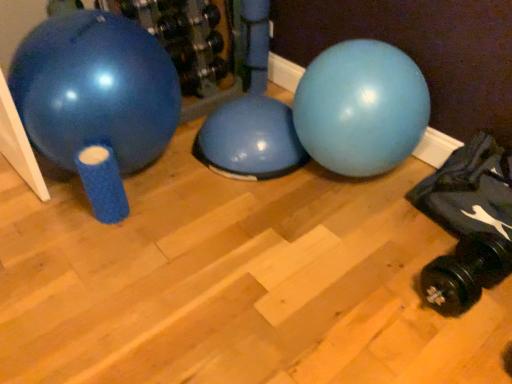
What is the approximate width of matte blue exercise ball at left?

matte blue exercise ball at left is 26.15 inches wide.

This screenshot has height=384, width=512. What do you see at coordinates (95, 89) in the screenshot?
I see `matte blue exercise ball at left` at bounding box center [95, 89].

The height and width of the screenshot is (384, 512). I want to click on matte blue exercise ball at left, so click(x=95, y=89).

Locate an element on the screen. Image resolution: width=512 pixels, height=384 pixels. black rubber dumbbell at lower right is located at coordinates (466, 272).

What do you see at coordinates (466, 272) in the screenshot? I see `black rubber dumbbell at lower right` at bounding box center [466, 272].

In order to face black rubber dumbbell at lower right, should I rotate leftwards or rightwards?

You should look right and rotate roughly 26.144 degrees.

Locate an element on the screen. This screenshot has height=384, width=512. matte blue exercise ball at left is located at coordinates (95, 89).

In the image, is matte blue exercise ball at left on the left side or the right side of black rubber dumbbell at lower right?

From the image, it's evident that matte blue exercise ball at left is to the left of black rubber dumbbell at lower right.

From the picture: Is the position of matte blue exercise ball at left more distant than that of black rubber dumbbell at lower right?

Yes, matte blue exercise ball at left is behind black rubber dumbbell at lower right.

Considering the positions of point (91, 118) and point (426, 276), is point (91, 118) closer or farther from the camera than point (426, 276)?

Point (91, 118).

From the image's perspective, is matte blue exercise ball at left beneath black rubber dumbbell at lower right?

No, from the image's perspective, matte blue exercise ball at left is not beneath black rubber dumbbell at lower right.

From a real-world perspective, does matte blue exercise ball at left sit lower than black rubber dumbbell at lower right?

No, from a real-world perspective, matte blue exercise ball at left is not below black rubber dumbbell at lower right.

Considering the sizes of objects matte blue exercise ball at left and black rubber dumbbell at lower right in the image provided, who is thinner, matte blue exercise ball at left or black rubber dumbbell at lower right?

Thinner between the two is black rubber dumbbell at lower right.

Who is taller, matte blue exercise ball at left or black rubber dumbbell at lower right?

matte blue exercise ball at left is taller.

Considering the sizes of objects matte blue exercise ball at left and black rubber dumbbell at lower right in the image provided, who is bigger, matte blue exercise ball at left or black rubber dumbbell at lower right?

matte blue exercise ball at left is bigger.

Is matte blue exercise ball at left outside of black rubber dumbbell at lower right?

Yes, matte blue exercise ball at left is not within black rubber dumbbell at lower right.

Is matte blue exercise ball at left placed right next to black rubber dumbbell at lower right?

No, matte blue exercise ball at left is not next to black rubber dumbbell at lower right.

Is matte blue exercise ball at left looking in the opposite direction of black rubber dumbbell at lower right?

No, matte blue exercise ball at left is not facing away from black rubber dumbbell at lower right.

Can you tell me how much matte blue exercise ball at left and black rubber dumbbell at lower right differ in facing direction?

85.8 degrees separate the facing orientations of matte blue exercise ball at left and black rubber dumbbell at lower right.

Image resolution: width=512 pixels, height=384 pixels. I want to click on ball on the left side of black rubber dumbbell at lower right, so click(x=95, y=89).

Between black rubber dumbbell at lower right and matte blue exercise ball at left, which one appears on the right side from the viewer's perspective?

black rubber dumbbell at lower right.

Based on the photo, does black rubber dumbbell at lower right come in front of matte blue exercise ball at left?

Yes.

Is point (492, 242) closer or farther from the camera than point (99, 97)?

Point (492, 242) appears to be farther away from the viewer than point (99, 97).

From the image's perspective, which object appears higher, black rubber dumbbell at lower right or matte blue exercise ball at left?

matte blue exercise ball at left appears higher in the image.

From a real-world perspective, which object rests below the other?

black rubber dumbbell at lower right.

Is black rubber dumbbell at lower right thinner than matte blue exercise ball at left?

Yes.

Who is taller, black rubber dumbbell at lower right or matte blue exercise ball at left?

Standing taller between the two is matte blue exercise ball at left.

Does black rubber dumbbell at lower right have a larger size compared to matte blue exercise ball at left?

Incorrect, black rubber dumbbell at lower right is not larger than matte blue exercise ball at left.

Can we say black rubber dumbbell at lower right lies outside matte blue exercise ball at left?

Yes, black rubber dumbbell at lower right is not within matte blue exercise ball at left.

Would you say black rubber dumbbell at lower right is a long distance from matte blue exercise ball at left?

That's right, there is a large distance between black rubber dumbbell at lower right and matte blue exercise ball at left.

Could you tell me if black rubber dumbbell at lower right is turned towards matte blue exercise ball at left?

No, black rubber dumbbell at lower right does not turn towards matte blue exercise ball at left.

How different are the orientations of black rubber dumbbell at lower right and matte blue exercise ball at left in degrees?

85.8 degrees separate the facing orientations of black rubber dumbbell at lower right and matte blue exercise ball at left.

Consider the image. Measure the distance from black rubber dumbbell at lower right to matte blue exercise ball at left.

The distance of black rubber dumbbell at lower right from matte blue exercise ball at left is 1.41 meters.

Locate an element on the screen. The width and height of the screenshot is (512, 384). dumbbell below the matte blue exercise ball at left (from a real-world perspective) is located at coordinates (466, 272).

You are a GUI agent. You are given a task and a screenshot of the screen. Output one action in this format:
    pyautogui.click(x=<x>, y=<y>)
    Task: Click on the ball behind the black rubber dumbbell at lower right
    This screenshot has width=512, height=384.
    Given the screenshot: What is the action you would take?
    pyautogui.click(x=95, y=89)

Where is `ball above the black rubber dumbbell at lower right (from a real-world perspective)`? The height and width of the screenshot is (384, 512). ball above the black rubber dumbbell at lower right (from a real-world perspective) is located at coordinates coord(95,89).